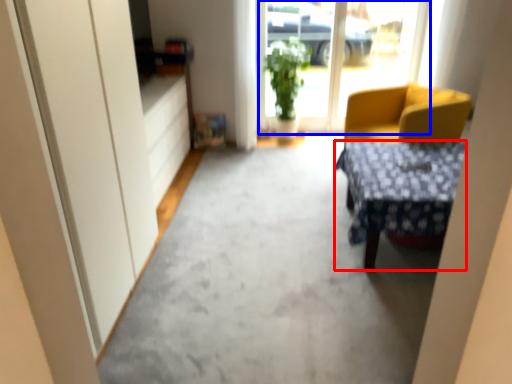
Question: Which object appears closest to the camera in this image, desk (highlighted by a red box) or window screen (highlighted by a blue box)?

Choices:
 (A) desk
 (B) window screen

Answer: (A)